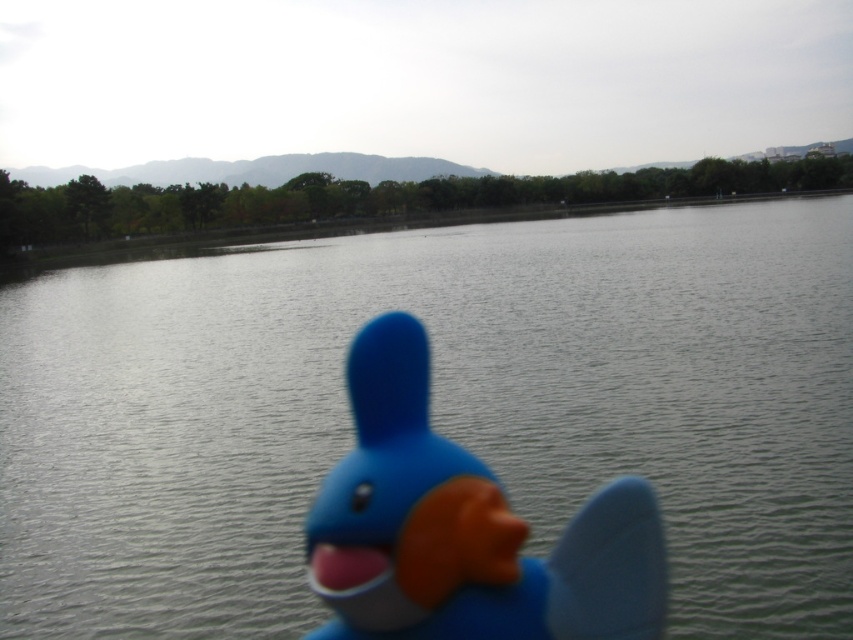
Which is below, smooth gray water at center or blue rubber duck at center?

blue rubber duck at center is below.

Based on the photo, does smooth gray water at center appear over blue rubber duck at center?

Indeed, smooth gray water at center is positioned over blue rubber duck at center.

Image resolution: width=853 pixels, height=640 pixels. What do you see at coordinates (434, 410) in the screenshot?
I see `smooth gray water at center` at bounding box center [434, 410].

The width and height of the screenshot is (853, 640). In order to click on smooth gray water at center in this screenshot , I will do click(434, 410).